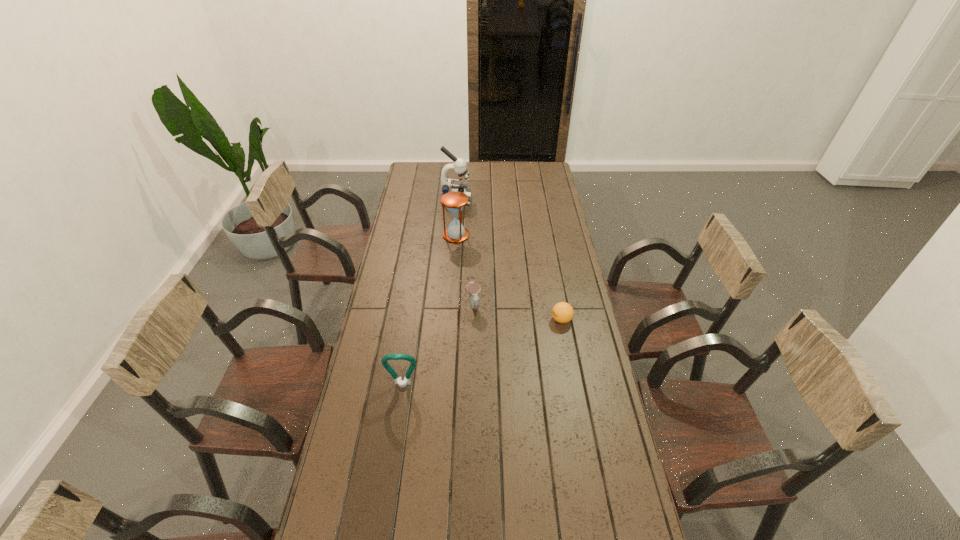
The width and height of the screenshot is (960, 540). I want to click on vacant space that satisfies the following two spatial constraints: 1. at the eyepiece of the watch; 2. on the left side of the tallest object, so click(447, 306).